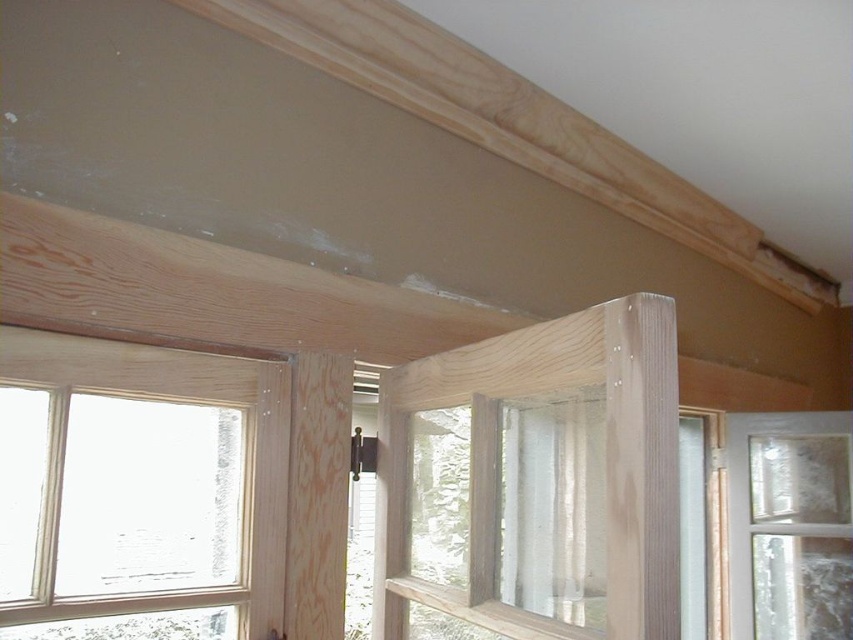
Question: Can you confirm if natural wood window frame at left is positioned to the right of clear glass window at center?

Choices:
 (A) yes
 (B) no

Answer: (B)

Question: Is natural wood window frame at left wider than clear glass window at center?

Choices:
 (A) no
 (B) yes

Answer: (A)

Question: Among these objects, which one is farthest from the camera?

Choices:
 (A) clear glass window at center
 (B) natural wood window frame at left

Answer: (A)

Question: Is the position of natural wood window frame at left less distant than that of clear glass window at center?

Choices:
 (A) no
 (B) yes

Answer: (B)

Question: Which of the following is the farthest from the observer?

Choices:
 (A) clear glass window at center
 (B) natural wood window frame at left

Answer: (A)